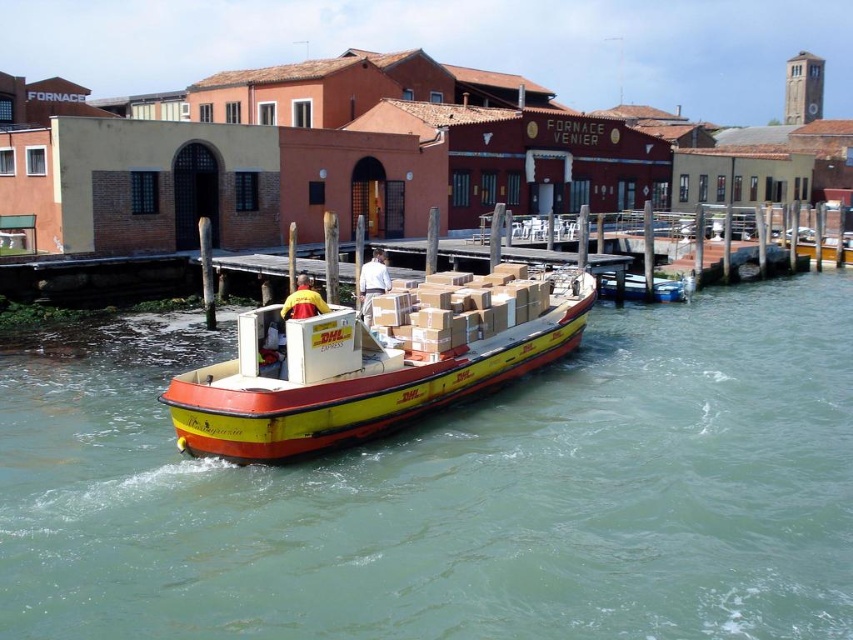
You are standing at the point with coordinates point (x=398, y=323) and want to walk to the point with coordinates point (x=575, y=342). Is the destination point behind you or in front of you?

The destination point (x=575, y=342) is behind the starting point (x=398, y=323), so it is behind you.

You are standing at the point marked as point (456, 492) and want to walk to the nearest dock. Which direction should you go?

The green water at center is located at point (456, 492), so you should walk towards the dock which is on the right side of the green water at center.